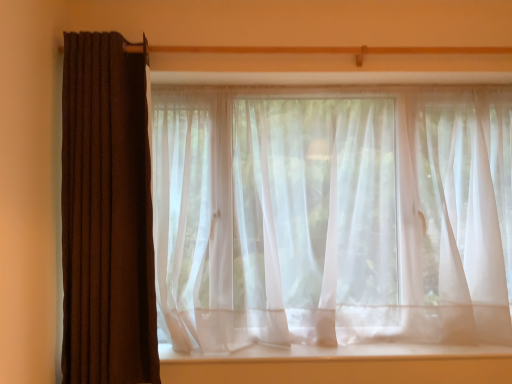
Question: Should I look upward or downward to see sheer white curtain at center, acting as the second curtain starting from the left?

Choices:
 (A) up
 (B) down

Answer: (B)

Question: Is sheer white curtain at center, acting as the second curtain starting from the left, looking in the opposite direction of brown textured curtain at left, which is the 1th curtain in left-to-right order?

Choices:
 (A) yes
 (B) no

Answer: (B)

Question: From a real-world perspective, is sheer white curtain at center, acting as the second curtain starting from the left, over brown textured curtain at left, which is the 1th curtain in left-to-right order?

Choices:
 (A) no
 (B) yes

Answer: (A)

Question: From a real-world perspective, does sheer white curtain at center, the 1th curtain from the right, sit lower than brown textured curtain at left, which is the 1th curtain in left-to-right order?

Choices:
 (A) no
 (B) yes

Answer: (B)

Question: Is sheer white curtain at center, acting as the second curtain starting from the left, not inside brown textured curtain at left, which appears as the 2th curtain when viewed from the right?

Choices:
 (A) no
 (B) yes

Answer: (B)

Question: Does sheer white curtain at center, acting as the second curtain starting from the left, appear on the left side of brown textured curtain at left, which is the 1th curtain in left-to-right order?

Choices:
 (A) no
 (B) yes

Answer: (A)

Question: Can you confirm if sheer white curtain at center, acting as the second curtain starting from the left, is thinner than brown textured curtain at left, which is the 1th curtain in left-to-right order?

Choices:
 (A) no
 (B) yes

Answer: (A)

Question: From the image's perspective, is white sheer fabric at center on brown textured curtain at left, which is the 1th curtain in left-to-right order?

Choices:
 (A) yes
 (B) no

Answer: (B)

Question: Is white sheer fabric at center wider than brown textured curtain at left, which appears as the 2th curtain when viewed from the right?

Choices:
 (A) yes
 (B) no

Answer: (A)

Question: Is white sheer fabric at center bigger than brown textured curtain at left, which appears as the 2th curtain when viewed from the right?

Choices:
 (A) yes
 (B) no

Answer: (B)

Question: Would you say white sheer fabric at center is a long distance from brown textured curtain at left, which appears as the 2th curtain when viewed from the right?

Choices:
 (A) no
 (B) yes

Answer: (A)

Question: Is white sheer fabric at center positioned before brown textured curtain at left, which is the 1th curtain in left-to-right order?

Choices:
 (A) no
 (B) yes

Answer: (A)

Question: Considering the relative positions of white sheer fabric at center and brown textured curtain at left, which is the 1th curtain in left-to-right order, in the image provided, is white sheer fabric at center to the left of brown textured curtain at left, which is the 1th curtain in left-to-right order, from the viewer's perspective?

Choices:
 (A) no
 (B) yes

Answer: (A)

Question: Does white sheer fabric at center come behind sheer white curtain at center, the 1th curtain from the right?

Choices:
 (A) no
 (B) yes

Answer: (B)